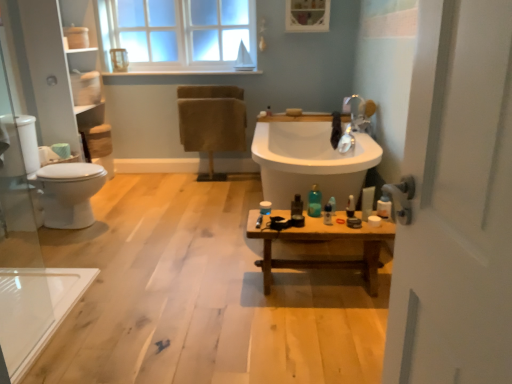
Find the location of a particular element. This screenshot has height=384, width=512. vacant space behind transparent glass door at left is located at coordinates (72, 321).